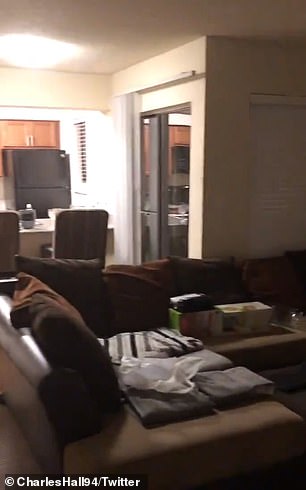
Locate an element on the screen. This screenshot has width=306, height=490. white wall is located at coordinates (103, 157), (251, 193), (161, 99), (26, 111).